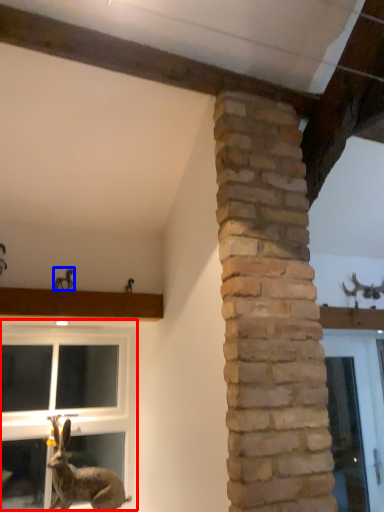
Question: Among these objects, which one is nearest to the camera, window (highlighted by a red box) or animal (highlighted by a blue box)?

Choices:
 (A) window
 (B) animal

Answer: (A)